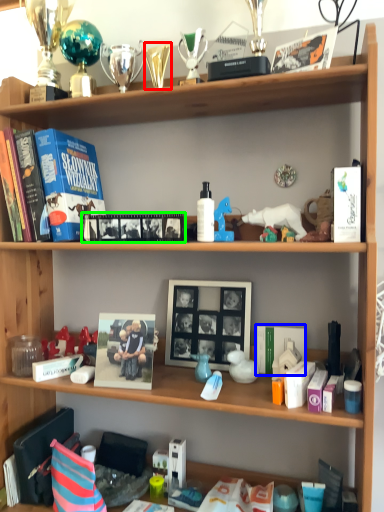
Question: Which object is the farthest from toy (highlighted by a red box)? Choose among these: magazine (highlighted by a blue box) or magazine (highlighted by a green box).

Choices:
 (A) magazine
 (B) magazine

Answer: (A)